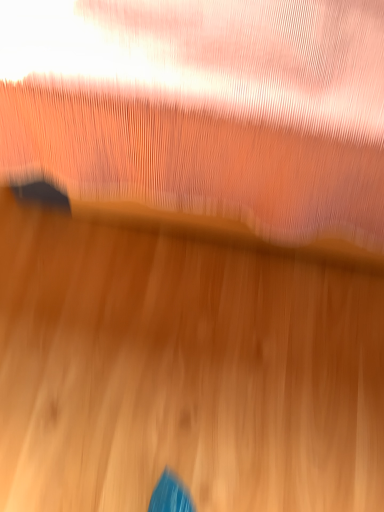
I want to click on pink sheer curtain at upper center, so click(204, 103).

What do you see at coordinates (204, 103) in the screenshot? I see `pink sheer curtain at upper center` at bounding box center [204, 103].

In order to face wooden floor at center, should I rotate leftwards or rightwards?

To align with it, rotate left about 1.542°.

What is the approximate height of wooden floor at center?

wooden floor at center is 1.72 inches tall.

At what (x,y) coordinates should I click in order to perform the action: click on wooden floor at center. Please return your answer as a coordinate pair (x, y). Looking at the image, I should click on (182, 372).

The height and width of the screenshot is (512, 384). Describe the element at coordinates (182, 372) in the screenshot. I see `wooden floor at center` at that location.

Locate an element on the screen. Image resolution: width=384 pixels, height=512 pixels. pink sheer curtain at upper center is located at coordinates (204, 103).

Which is more to the left, pink sheer curtain at upper center or wooden floor at center?

wooden floor at center is more to the left.

Which object is further away from the camera taking this photo, pink sheer curtain at upper center or wooden floor at center?

wooden floor at center is further from the camera.

Does point (141, 58) appear closer or farther from the camera than point (309, 465)?

Point (141, 58) is positioned closer to the camera compared to point (309, 465).

From the image's perspective, is pink sheer curtain at upper center positioned above or below wooden floor at center?

From the image's perspective, pink sheer curtain at upper center appears above wooden floor at center.

From a real-world perspective, is pink sheer curtain at upper center located higher than wooden floor at center?

Yes.

Does pink sheer curtain at upper center have a greater width compared to wooden floor at center?

Yes, pink sheer curtain at upper center is wider than wooden floor at center.

Considering the sizes of objects pink sheer curtain at upper center and wooden floor at center in the image provided, who is shorter, pink sheer curtain at upper center or wooden floor at center?

wooden floor at center.

Considering the sizes of objects pink sheer curtain at upper center and wooden floor at center in the image provided, who is smaller, pink sheer curtain at upper center or wooden floor at center?

wooden floor at center.

In the scene shown: Is pink sheer curtain at upper center completely or partially outside of wooden floor at center?

Yes, pink sheer curtain at upper center is located beyond the bounds of wooden floor at center.

Is pink sheer curtain at upper center far from wooden floor at center?

No, there isn't a large distance between pink sheer curtain at upper center and wooden floor at center.

Is pink sheer curtain at upper center positioned with its back to wooden floor at center?

No, pink sheer curtain at upper center is not facing the opposite direction of wooden floor at center.

How many degrees apart are the facing directions of pink sheer curtain at upper center and wooden floor at center?

The facing directions of pink sheer curtain at upper center and wooden floor at center are 90 degrees apart.

Measure the distance between pink sheer curtain at upper center and wooden floor at center.

18.36 inches.

Locate an element on the screen. This screenshot has width=384, height=512. wood that is on the left side of pink sheer curtain at upper center is located at coordinates (182, 372).

Which object is positioned more to the right, wooden floor at center or pink sheer curtain at upper center?

pink sheer curtain at upper center.

Between wooden floor at center and pink sheer curtain at upper center, which one is positioned behind?

wooden floor at center is more distant.

Considering the positions of point (123, 267) and point (379, 49), is point (123, 267) closer or farther from the camera than point (379, 49)?

Point (123, 267) is farther from the camera than point (379, 49).

From the image's perspective, is wooden floor at center on top of pink sheer curtain at upper center?

No, from the image's perspective, wooden floor at center is not over pink sheer curtain at upper center.

From a real-world perspective, relative to pink sheer curtain at upper center, is wooden floor at center vertically above or below?

wooden floor at center is below pink sheer curtain at upper center.

Which of these two, wooden floor at center or pink sheer curtain at upper center, is wider?

pink sheer curtain at upper center.

From their relative heights in the image, would you say wooden floor at center is taller or shorter than pink sheer curtain at upper center?

Clearly, wooden floor at center is shorter compared to pink sheer curtain at upper center.

In the scene shown: Who is bigger, wooden floor at center or pink sheer curtain at upper center?

With larger size is pink sheer curtain at upper center.

Is wooden floor at center surrounding pink sheer curtain at upper center?

No, pink sheer curtain at upper center is not surrounded by wooden floor at center.

Is wooden floor at center not close to pink sheer curtain at upper center?

wooden floor at center is near pink sheer curtain at upper center, not far away.

Is pink sheer curtain at upper center at the back of wooden floor at center?

No, pink sheer curtain at upper center is not at the back of wooden floor at center.

What's the angular difference between wooden floor at center and pink sheer curtain at upper center's facing directions?

90 degrees separate the facing orientations of wooden floor at center and pink sheer curtain at upper center.

In the image, there is a pink sheer curtain at upper center. Where is `wood below it (from a real-world perspective)`? Image resolution: width=384 pixels, height=512 pixels. wood below it (from a real-world perspective) is located at coordinates (182, 372).

I want to click on curtain above the wooden floor at center (from the image's perspective), so click(x=204, y=103).

In order to click on curtain that is above the wooden floor at center (from a real-world perspective) in this screenshot , I will do `click(204, 103)`.